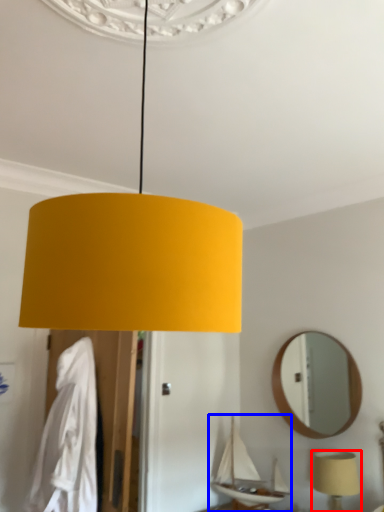
Question: Which of the following is the closest to the observer, lamp (highlighted by a red box) or boat (highlighted by a blue box)?

Choices:
 (A) lamp
 (B) boat

Answer: (A)